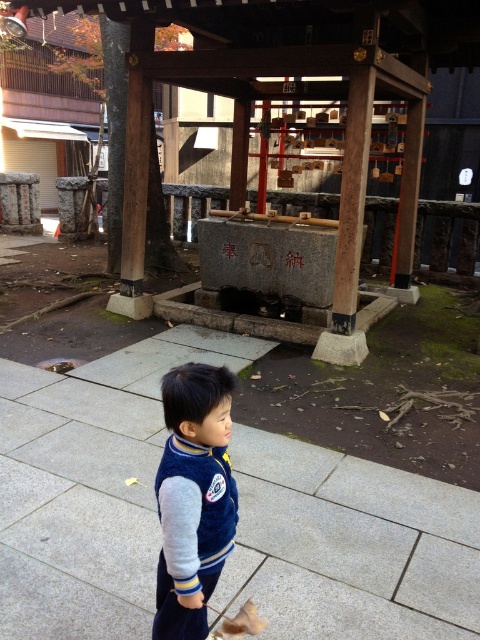
Measure the distance from gray concrete pavement at center to velvet blue jacket at center.

gray concrete pavement at center is 3.47 feet from velvet blue jacket at center.

In the scene shown: Measure the distance between gray concrete pavement at center and camera.

gray concrete pavement at center and camera are 1.98 meters apart from each other.

Measure the distance between point (280, 477) and camera.

10.15 feet

Image resolution: width=480 pixels, height=640 pixels. I want to click on gray concrete pavement at center, so click(x=88, y=484).